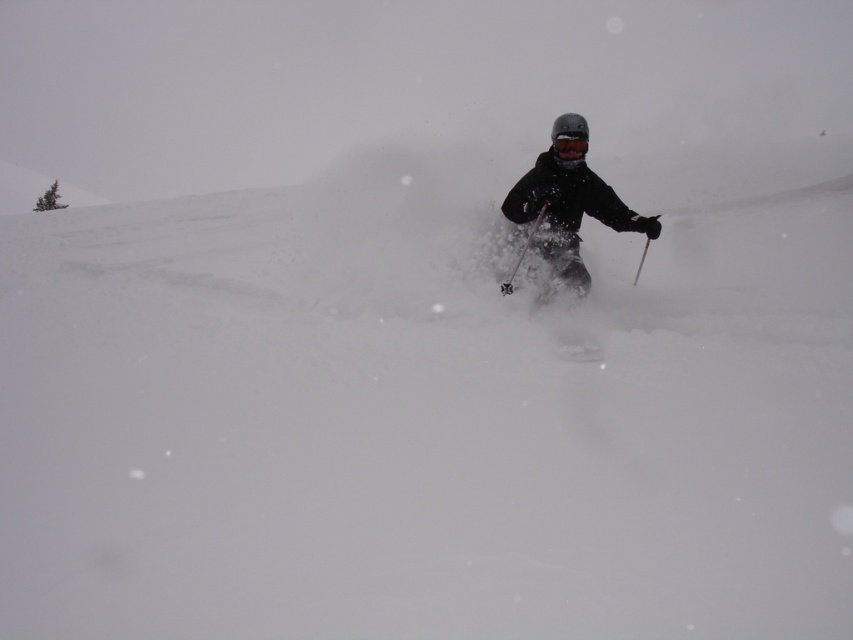
You are a photographer trying to capture the skier in the snow. You notice the transparent plastic goggles at center and the metallic silver ski pole at center. Which object should you focus on if you want to capture the larger object in your shot?

The metallic silver ski pole at center is larger than the transparent plastic goggles at center, so focusing on it will allow you to capture the larger object in your shot.

You are a photographer trying to capture the skier in the image. You want to ensure that both the matte black ski suit at center and the transparent plastic goggles at center are in focus. Given that your camera can only focus on objects within a 15 inch range, will both items be in focus?

The distance between the matte black ski suit at center and transparent plastic goggles at center is 14.88 inches, which is within the 15 inch range. Therefore, both items will be in focus.

You are a photographer trying to capture the skier in the snow. You notice two points marked in the scene. Which point, point [534,196] or point [558,138], is closer to your camera lens?

Point [558,138] is closer to the camera lens because it is less further than point [534,196].